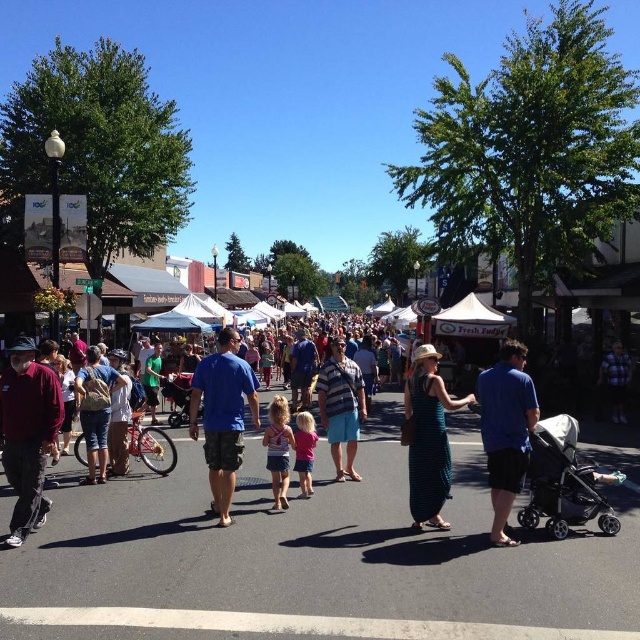
Question: Which point is closer to the camera?

Choices:
 (A) light pink fabric dress at center
 (B) blue cotton shirt at right
 (C) pink fabric dress at center

Answer: (B)

Question: Which of the following is the farthest from the observer?

Choices:
 (A) plaid shirt at center
 (B) maroon fabric shirt at left
 (C) blue cotton shirt at center

Answer: (A)

Question: Considering the relative positions of striped shirt at center and plaid shirt at center in the image provided, where is striped shirt at center located with respect to plaid shirt at center?

Choices:
 (A) below
 (B) above

Answer: (B)

Question: Can you confirm if blue cotton shirt at center is positioned to the right of striped shirt at center?

Choices:
 (A) yes
 (B) no

Answer: (B)

Question: Where is blue cotton shirt at center located in relation to light pink fabric dress at center in the image?

Choices:
 (A) left
 (B) right

Answer: (A)

Question: Among these points, which one is nearest to the camera?

Choices:
 (A) (349, 394)
 (B) (22, 497)

Answer: (B)